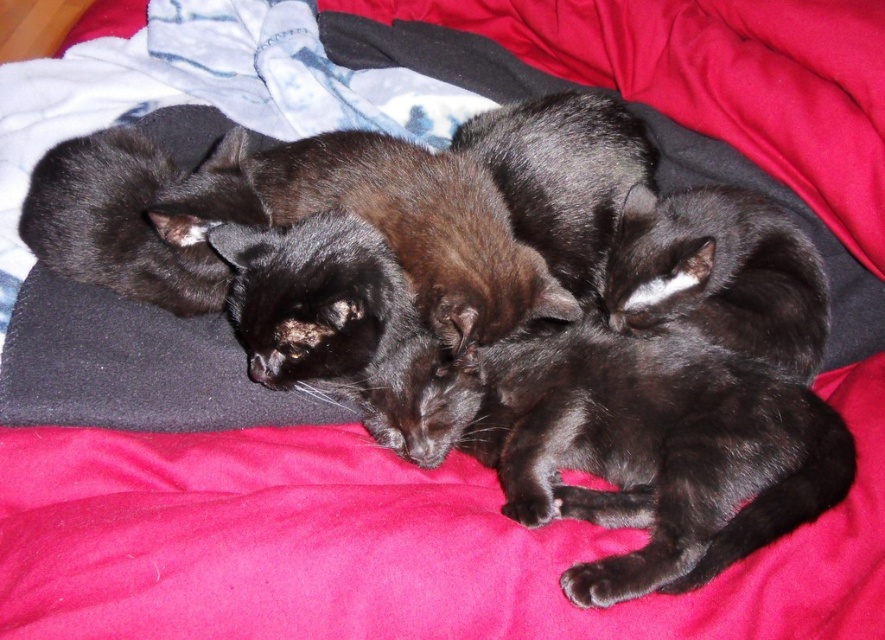
Question: Which point appears closest to the camera in this image?

Choices:
 (A) (773, 401)
 (B) (429, 365)

Answer: (A)

Question: Which point is closer to the camera taking this photo?

Choices:
 (A) (152, 147)
 (B) (624, 396)

Answer: (B)

Question: Can you confirm if black silky fur cat at lower right is positioned above shiny black cat at center?

Choices:
 (A) yes
 (B) no

Answer: (B)

Question: Observing the image, what is the correct spatial positioning of shiny black cat at center in reference to black fur cat at center?

Choices:
 (A) below
 (B) above

Answer: (A)

Question: Is black silky fur cat at lower right above black fur cat at center?

Choices:
 (A) yes
 (B) no

Answer: (B)

Question: Which point is farther to the camera?

Choices:
 (A) (58, 211)
 (B) (641, 337)
 (C) (319, 349)

Answer: (A)